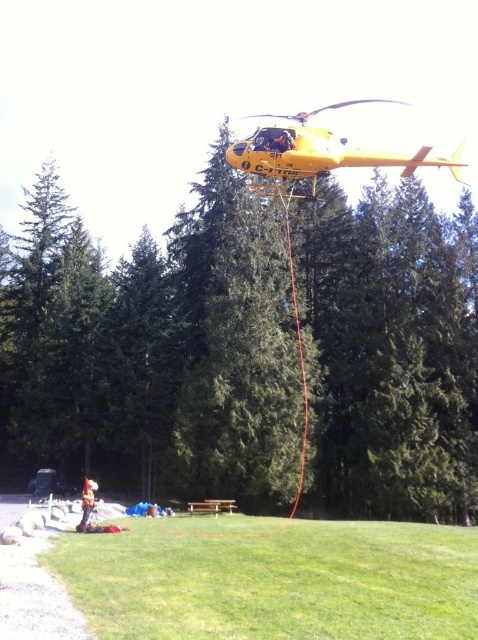
Question: Which object is the closest to the yellow matte helicopter at upper center?

Choices:
 (A) green textured tree at center
 (B) brown wooden picnic table at center

Answer: (A)

Question: Does yellow matte helicopter at upper center have a smaller size compared to orange reflective vest at lower center?

Choices:
 (A) no
 (B) yes

Answer: (A)

Question: Which point is closer to the camera?

Choices:
 (A) (212, 500)
 (B) (91, 499)
 (C) (373, 193)
 (D) (275, 144)

Answer: (D)

Question: Is yellow matte helicopter at upper center behind brown wooden picnic table at center?

Choices:
 (A) yes
 (B) no

Answer: (B)

Question: Among these objects, which one is farthest from the camera?

Choices:
 (A) yellow matte helicopter at upper center
 (B) brown wooden picnic table at center
 (C) orange reflective vest at lower center

Answer: (B)

Question: Does yellow matte helicopter at upper center lie in front of orange reflective vest at lower center?

Choices:
 (A) no
 (B) yes

Answer: (B)